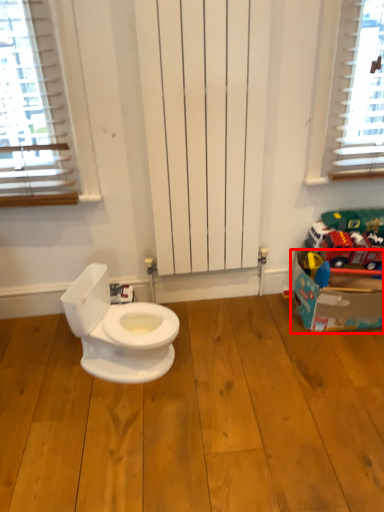
Question: Where is cardboard box (annotated by the red box) located in relation to hardwood in the image?

Choices:
 (A) left
 (B) right

Answer: (B)